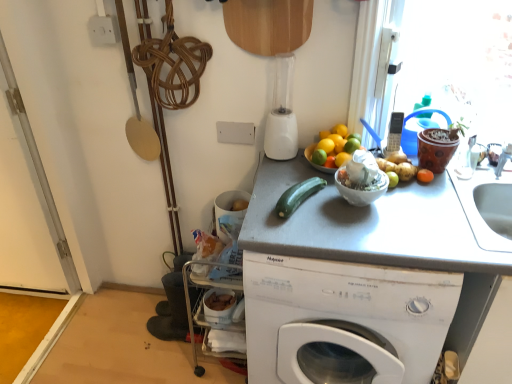
Where is `free location in front of orange matte at upper center, marked as the third orange in a bottom-to-top arrangement`? The image size is (512, 384). free location in front of orange matte at upper center, marked as the third orange in a bottom-to-top arrangement is located at coordinates (327, 195).